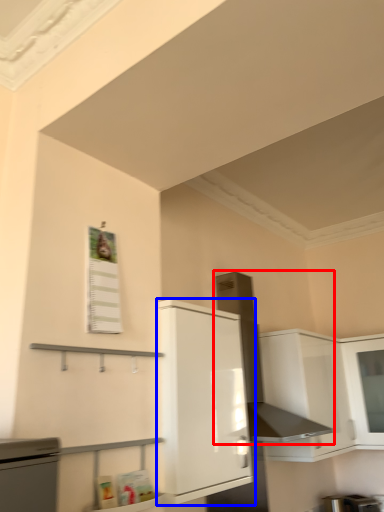
Question: Which of the following is the closest to the observer, exhaust hood (highlighted by a red box) or cabinetry (highlighted by a blue box)?

Choices:
 (A) exhaust hood
 (B) cabinetry

Answer: (B)